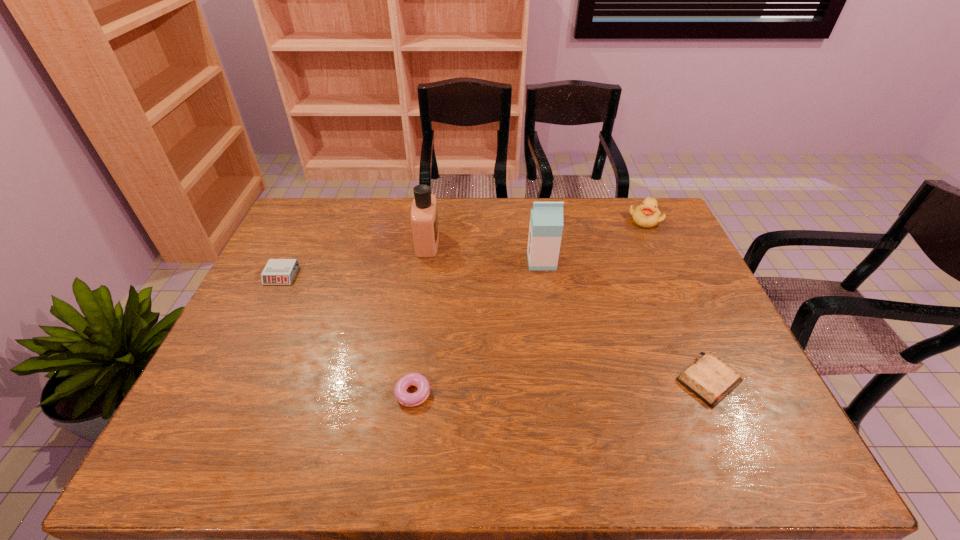
Locate an element on the screen. free space located 0.300m on the back of the alarm clock is located at coordinates (312, 212).

Find the location of a particular element. This screenshot has width=960, height=540. vacant region located 0.100m on the left of the doughnut is located at coordinates (353, 393).

Locate an element on the screen. vacant space situated on the front of the shortest object is located at coordinates tap(749, 469).

The image size is (960, 540). Identify the location of perfume positioned at the far edge. (424, 213).

Identify the location of duckling that is at the far edge. (647, 215).

At what (x,y) coordinates should I click in order to perform the action: click on object present at the left edge. Please return your answer as a coordinate pair (x, y). This screenshot has width=960, height=540. Looking at the image, I should click on (277, 271).

Identify the location of duckling positioned at the right edge. Image resolution: width=960 pixels, height=540 pixels. (647, 215).

Identify the location of diary positioned at the right edge. Image resolution: width=960 pixels, height=540 pixels. (711, 379).

Identify the location of object positioned at the far right corner. (647, 215).

In order to click on vacant space at the far edge in this screenshot , I will do `click(595, 204)`.